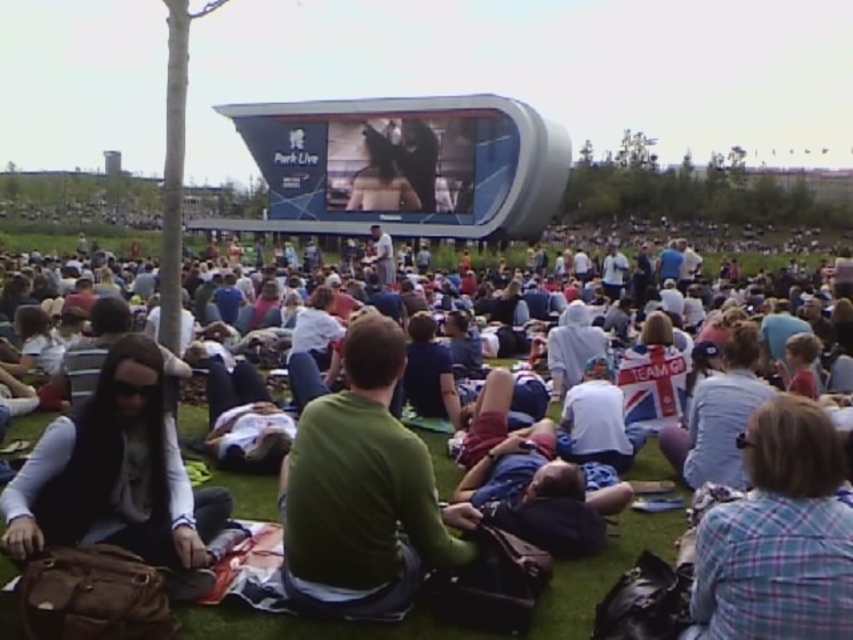
Measure the distance between green matte shirt at center and camera.

green matte shirt at center is 143.66 feet from camera.

In order to click on green matte shirt at center in this screenshot , I will do `click(361, 492)`.

You are a GUI agent. You are given a task and a screenshot of the screen. Output one action in this format:
    pyautogui.click(x=<x>, y=<y>)
    Task: Click on the green matte shirt at center
    This screenshot has height=640, width=853.
    Given the screenshot: What is the action you would take?
    pyautogui.click(x=361, y=492)

Measure the distance from green matte shirt at center to plaid fabric shirt at lower right.

green matte shirt at center and plaid fabric shirt at lower right are 21.68 meters apart.

Identify the location of green matte shirt at center. Image resolution: width=853 pixels, height=640 pixels. (361, 492).

Between point (518, 257) and point (148, 529), which one is positioned in front?

Point (148, 529)

Who is shorter, green cotton shirt at center or brown leather backpack at lower left?

With less height is brown leather backpack at lower left.

Who is more distant from viewer, (296, 416) or (97, 404)?

Point (296, 416)

At what (x,y) coordinates should I click in order to perform the action: click on green cotton shirt at center. Please return your answer as a coordinate pair (x, y). This screenshot has width=853, height=640. Looking at the image, I should click on (613, 552).